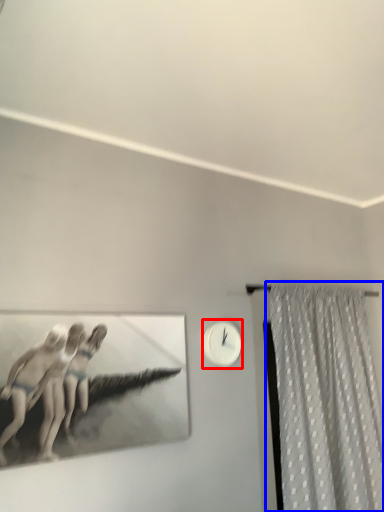
Question: Which object appears closest to the camera in this image, clock (highlighted by a red box) or curtain (highlighted by a blue box)?

Choices:
 (A) clock
 (B) curtain

Answer: (B)